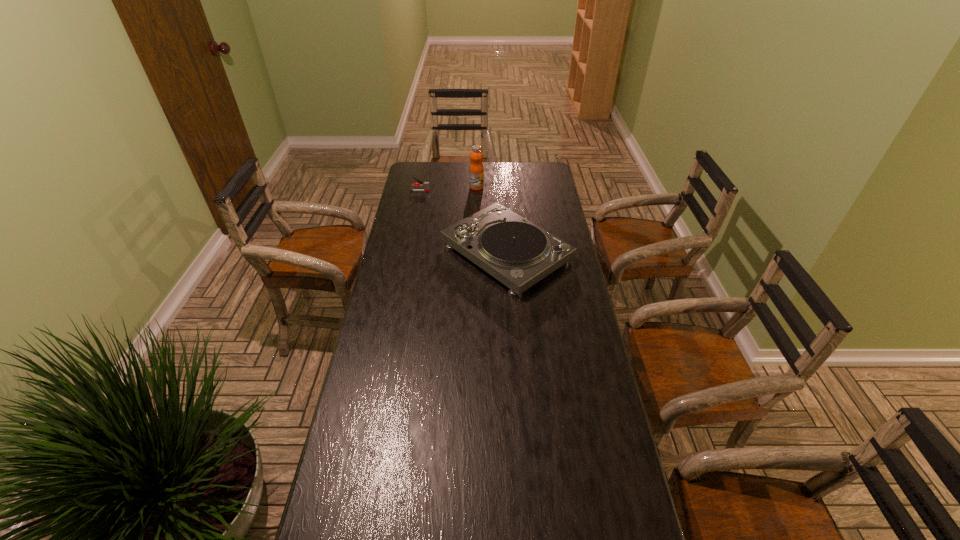
You are a GUI agent. You are given a task and a screenshot of the screen. Output one action in this format:
    pyautogui.click(x=<x>, y=<y>)
    Task: Click on the fruit juice
    This screenshot has width=960, height=540.
    Given the screenshot: What is the action you would take?
    pos(476,156)

At what (x,y) coordinates should I click in order to perform the action: click on record player. Please return your answer as a coordinate pair (x, y). Looking at the image, I should click on pyautogui.click(x=518, y=253).

Locate an element on the screen. The height and width of the screenshot is (540, 960). the second shortest object is located at coordinates (518, 253).

What are the coordinates of `the shortest object` in the screenshot? It's located at (426, 185).

The image size is (960, 540). Identify the location of stapler. (426, 185).

What are the coordinates of `free point located on the left of the fruit juice` in the screenshot? It's located at (445, 187).

Where is `free space located 0.180m on the back of the second tallest object`? Image resolution: width=960 pixels, height=540 pixels. free space located 0.180m on the back of the second tallest object is located at coordinates (502, 194).

I want to click on vacant area situated 0.080m on the handle side of the stapler, so click(446, 191).

At what (x,y) coordinates should I click in order to perform the action: click on object that is at the far edge. Please return your answer as a coordinate pair (x, y). The height and width of the screenshot is (540, 960). Looking at the image, I should click on (476, 156).

At what (x,y) coordinates should I click in order to perform the action: click on object that is at the left edge. Please return your answer as a coordinate pair (x, y). The image size is (960, 540). Looking at the image, I should click on tap(426, 185).